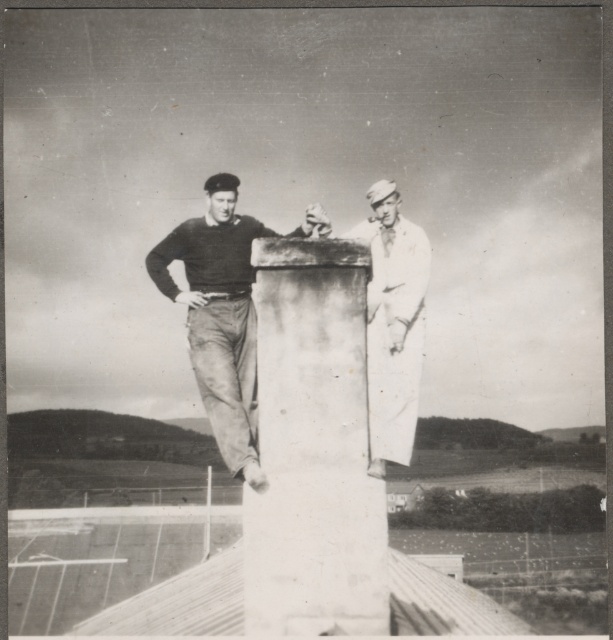
Question: Estimate the real-world distances between objects in this image. Which object is closer to the white stone pillar at center?

Choices:
 (A) white clothed sailor at right
 (B) dark gray sweater at center

Answer: (B)

Question: Which point is farther to the camera?

Choices:
 (A) (299, 333)
 (B) (373, 456)
 (C) (246, 458)

Answer: (C)

Question: Does white stone pillar at center appear over dark gray sweater at center?

Choices:
 (A) yes
 (B) no

Answer: (B)

Question: Which point appears closest to the camera in this image?

Choices:
 (A) (356, 289)
 (B) (172, 236)
 (C) (371, 284)

Answer: (A)

Question: Does dark gray sweater at center have a larger size compared to white clothed sailor at right?

Choices:
 (A) yes
 (B) no

Answer: (A)

Question: Is the position of white stone pillar at center less distant than that of dark gray sweater at center?

Choices:
 (A) yes
 (B) no

Answer: (A)